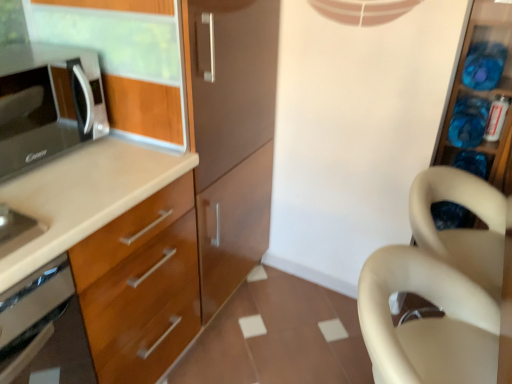
Question: Considering the relative sizes of beige matte chair at right and translucent plastic containers at right in the image provided, is beige matte chair at right taller than translucent plastic containers at right?

Choices:
 (A) yes
 (B) no

Answer: (B)

Question: Is beige matte chair at right far from translucent plastic containers at right?

Choices:
 (A) no
 (B) yes

Answer: (A)

Question: Is beige matte chair at right further to camera compared to translucent plastic containers at right?

Choices:
 (A) no
 (B) yes

Answer: (A)

Question: Is beige matte chair at right at the right side of translucent plastic containers at right?

Choices:
 (A) no
 (B) yes

Answer: (A)

Question: Is beige matte chair at right to the left of translucent plastic containers at right from the viewer's perspective?

Choices:
 (A) no
 (B) yes

Answer: (B)

Question: From a real-world perspective, is beige matte chair at right over translucent plastic containers at right?

Choices:
 (A) yes
 (B) no

Answer: (B)

Question: Is matte black microwave at left closer to camera compared to beige plastic swivel chair at right?

Choices:
 (A) no
 (B) yes

Answer: (A)

Question: Is matte black microwave at left shorter than beige plastic swivel chair at right?

Choices:
 (A) no
 (B) yes

Answer: (B)

Question: Are matte black microwave at left and beige plastic swivel chair at right located far from each other?

Choices:
 (A) no
 (B) yes

Answer: (B)

Question: Is the depth of matte black microwave at left greater than that of beige plastic swivel chair at right?

Choices:
 (A) no
 (B) yes

Answer: (B)

Question: Is matte black microwave at left positioned with its back to beige plastic swivel chair at right?

Choices:
 (A) yes
 (B) no

Answer: (B)

Question: Is matte black microwave at left not within beige plastic swivel chair at right?

Choices:
 (A) yes
 (B) no

Answer: (A)

Question: Are translucent plastic containers at right and matte black microwave at left located far from each other?

Choices:
 (A) yes
 (B) no

Answer: (A)